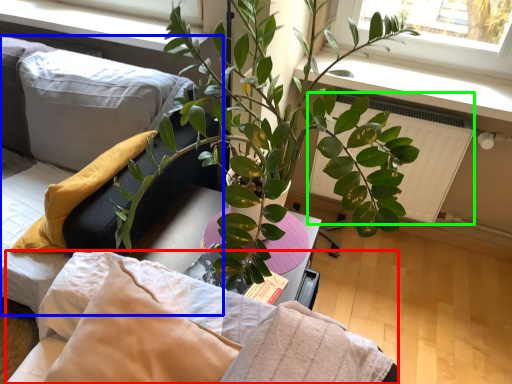
Question: Which object is positioned farthest from bedding (highlighted by a red box)? Select from couch (highlighted by a blue box) and radiator (highlighted by a green box).

Choices:
 (A) couch
 (B) radiator

Answer: (B)